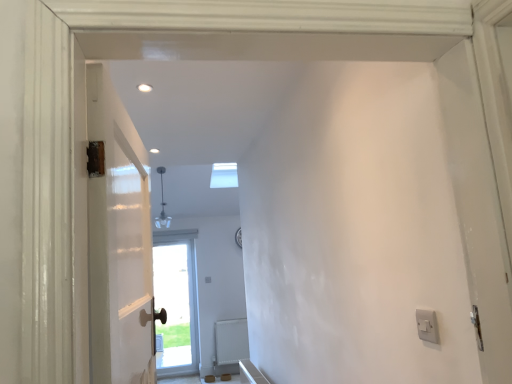
Question: Which direction should I rotate to face matte brown door at center, acting as the 2th door starting from the right, — up or down?

Choices:
 (A) up
 (B) down

Answer: (B)

Question: Is matte brown door at center, arranged as the first door when viewed from the left, shorter than white plastic switch at right?

Choices:
 (A) yes
 (B) no

Answer: (B)

Question: Does matte brown door at center, which is the 1th door in bottom-to-top order, touch white plastic switch at right?

Choices:
 (A) yes
 (B) no

Answer: (B)

Question: Considering the relative positions of matte brown door at center, acting as the 2th door starting from the right, and white plastic switch at right in the image provided, is matte brown door at center, acting as the 2th door starting from the right, behind white plastic switch at right?

Choices:
 (A) no
 (B) yes

Answer: (B)

Question: From the image's perspective, is matte brown door at center, placed as the 1th door when sorted from back to front, above white plastic switch at right?

Choices:
 (A) no
 (B) yes

Answer: (A)

Question: Is matte brown door at center, which is the second door in front-to-back order, closer to camera compared to white plastic switch at right?

Choices:
 (A) yes
 (B) no

Answer: (B)

Question: Considering the relative sizes of matte brown door at center, placed as the 1th door when sorted from back to front, and white plastic switch at right in the image provided, is matte brown door at center, placed as the 1th door when sorted from back to front, bigger than white plastic switch at right?

Choices:
 (A) yes
 (B) no

Answer: (A)

Question: From a real-world perspective, is white painted wood door at left, the second door positioned from the back, beneath matte brown door at center, arranged as the first door when viewed from the left?

Choices:
 (A) yes
 (B) no

Answer: (B)

Question: From a real-world perspective, is white painted wood door at left, which is the 1th door from top to bottom, on matte brown door at center, acting as the 2th door starting from the right?

Choices:
 (A) no
 (B) yes

Answer: (B)

Question: Considering the relative sizes of white painted wood door at left, which is the 1th door from top to bottom, and matte brown door at center, the 2th door viewed from the top, in the image provided, is white painted wood door at left, which is the 1th door from top to bottom, thinner than matte brown door at center, the 2th door viewed from the top,?

Choices:
 (A) yes
 (B) no

Answer: (A)

Question: Can you confirm if white painted wood door at left, the second door positioned from the back, is wider than matte brown door at center, arranged as the first door when viewed from the left?

Choices:
 (A) no
 (B) yes

Answer: (A)

Question: Is matte brown door at center, placed as the 1th door when sorted from back to front, a part of white painted wood door at left, the second door positioned from the bottom?

Choices:
 (A) no
 (B) yes

Answer: (A)

Question: Considering the relative positions of white painted wood door at left, marked as the 1th door in a right-to-left arrangement, and matte brown door at center, acting as the 2th door starting from the right, in the image provided, is white painted wood door at left, marked as the 1th door in a right-to-left arrangement, to the left of matte brown door at center, acting as the 2th door starting from the right, from the viewer's perspective?

Choices:
 (A) no
 (B) yes

Answer: (A)

Question: Is matte brown door at center, the 2th door viewed from the top, further to the viewer compared to white matte radiator at lower center?

Choices:
 (A) no
 (B) yes

Answer: (B)